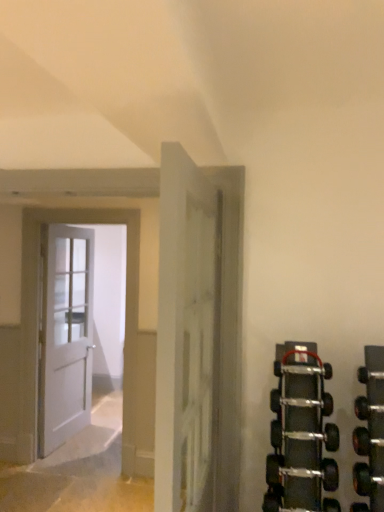
Question: Is white matte door at left, placed as the 1th door when sorted from back to front, positioned with its back to white matte door at center, the 1th door viewed from the right?

Choices:
 (A) yes
 (B) no

Answer: (B)

Question: Considering the relative sizes of white matte door at left, the third door when ordered from right to left, and white matte door at center, the 3th door from the back, in the image provided, is white matte door at left, the third door when ordered from right to left, taller than white matte door at center, the 3th door from the back,?

Choices:
 (A) no
 (B) yes

Answer: (B)

Question: Does white matte door at left, the 3th door when ordered from front to back, have a lesser height compared to white matte door at center, the 3th door in the left-to-right sequence?

Choices:
 (A) yes
 (B) no

Answer: (B)

Question: Considering the relative positions of white matte door at left, the first door positioned from the left, and white matte door at center, the 1th door viewed from the right, in the image provided, is white matte door at left, the first door positioned from the left, to the left of white matte door at center, the 1th door viewed from the right, from the viewer's perspective?

Choices:
 (A) yes
 (B) no

Answer: (A)

Question: From the image's perspective, would you say white matte door at left, the 3th door when ordered from front to back, is shown under white matte door at center, which ranks as the first door in front-to-back order?

Choices:
 (A) no
 (B) yes

Answer: (B)

Question: Does white matte door at left, the third door when ordered from right to left, have a greater width compared to white matte door at center, which ranks as the first door in front-to-back order?

Choices:
 (A) no
 (B) yes

Answer: (B)

Question: Is white wooden door at left, the second door from the back, at the back of white matte door at center, the 3th door from the back?

Choices:
 (A) no
 (B) yes

Answer: (A)

Question: Is white matte door at center, which ranks as the first door in front-to-back order, completely or partially outside of white wooden door at left, marked as the 2th door in a front-to-back arrangement?

Choices:
 (A) yes
 (B) no

Answer: (A)

Question: Can you confirm if white matte door at center, the 3th door in the left-to-right sequence, is taller than white wooden door at left, the 2th door when ordered from right to left?

Choices:
 (A) no
 (B) yes

Answer: (A)

Question: Does white matte door at center, the 3th door in the left-to-right sequence, have a smaller size compared to white wooden door at left, marked as the 2th door in a front-to-back arrangement?

Choices:
 (A) no
 (B) yes

Answer: (A)

Question: Does white matte door at center, which ranks as the first door in front-to-back order, have a greater width compared to white wooden door at left, the second door from the back?

Choices:
 (A) yes
 (B) no

Answer: (A)

Question: Is white matte door at center, the 1th door viewed from the right, not close to white wooden door at left, the 2th door from the left?

Choices:
 (A) no
 (B) yes

Answer: (B)

Question: Does white matte door at center, the 1th door viewed from the right, come behind white matte door at left, the third door when ordered from right to left?

Choices:
 (A) no
 (B) yes

Answer: (A)